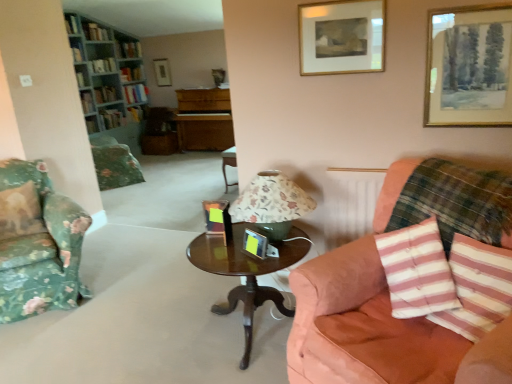
Question: From a real-world perspective, is hardcover book at upper left, which is the first book in top-to-bottom order, positioned under pink striped cushion at right, which is counted as the first pillow, starting from the right, based on gravity?

Choices:
 (A) yes
 (B) no

Answer: (B)

Question: Considering the relative sizes of hardcover book at upper left, which is the first book in top-to-bottom order, and pink striped cushion at right, the third pillow viewed from the left, in the image provided, is hardcover book at upper left, which is the first book in top-to-bottom order, shorter than pink striped cushion at right, the third pillow viewed from the left,?

Choices:
 (A) yes
 (B) no

Answer: (A)

Question: Considering the relative positions of hardcover book at upper left, which ranks as the 11th book in bottom-to-top order, and pink striped cushion at right, the third pillow viewed from the left, in the image provided, is hardcover book at upper left, which ranks as the 11th book in bottom-to-top order, to the left of pink striped cushion at right, the third pillow viewed from the left, from the viewer's perspective?

Choices:
 (A) no
 (B) yes

Answer: (B)

Question: Is hardcover book at upper left, which ranks as the 11th book in bottom-to-top order, positioned with its back to pink striped cushion at right, which is counted as the first pillow, starting from the right?

Choices:
 (A) no
 (B) yes

Answer: (A)

Question: Does hardcover book at upper left, which ranks as the 11th book in bottom-to-top order, come behind pink striped cushion at right, the 2th pillow positioned from the back?

Choices:
 (A) no
 (B) yes

Answer: (B)

Question: From the image's perspective, is hardcover book at upper left, arranged as the 9th book when ordered from the bottom, located above or below pink striped cushion at right, the third pillow viewed from the left?

Choices:
 (A) above
 (B) below

Answer: (A)

Question: Considering the positions of point (75, 18) and point (437, 221), is point (75, 18) closer or farther from the camera than point (437, 221)?

Choices:
 (A) farther
 (B) closer

Answer: (A)

Question: Is hardcover book at upper left, arranged as the 9th book when ordered from the bottom, spatially inside pink striped cushion at right, which is counted as the first pillow, starting from the right, or outside of it?

Choices:
 (A) outside
 (B) inside

Answer: (A)

Question: Is hardcover book at upper left, arranged as the 9th book when ordered from the bottom, wider or thinner than pink striped cushion at right, which is the 2th pillow in front-to-back order?

Choices:
 (A) thin
 (B) wide

Answer: (A)

Question: Do you think hardcover book at upper left, positioned as the eighth book in bottom-to-top order, is within wooden picture frame at upper center, the fourth picture frame positioned from the bottom, or outside of it?

Choices:
 (A) outside
 (B) inside

Answer: (A)

Question: From the image's perspective, is hardcover book at upper left, positioned as the eighth book in bottom-to-top order, positioned above or below wooden picture frame at upper center, acting as the 4th picture frame starting from the right?

Choices:
 (A) above
 (B) below

Answer: (A)

Question: Looking at their shapes, would you say hardcover book at upper left, which is the fourth book in top-to-bottom order, is wider or thinner than wooden picture frame at upper center, the fourth picture frame from the front?

Choices:
 (A) thin
 (B) wide

Answer: (A)

Question: Considering the positions of hardcover book at upper left, positioned as the eighth book in bottom-to-top order, and wooden picture frame at upper center, the second picture frame viewed from the top, in the image, is hardcover book at upper left, positioned as the eighth book in bottom-to-top order, taller or shorter than wooden picture frame at upper center, the second picture frame viewed from the top,?

Choices:
 (A) short
 (B) tall

Answer: (A)

Question: Choose the correct answer: Is floral fabric lampshade at center inside hardcover book at center, placed as the 6th book when sorted from top to bottom, or outside it?

Choices:
 (A) outside
 (B) inside

Answer: (A)

Question: Is point (251, 218) positioned closer to the camera than point (135, 89)?

Choices:
 (A) closer
 (B) farther

Answer: (A)